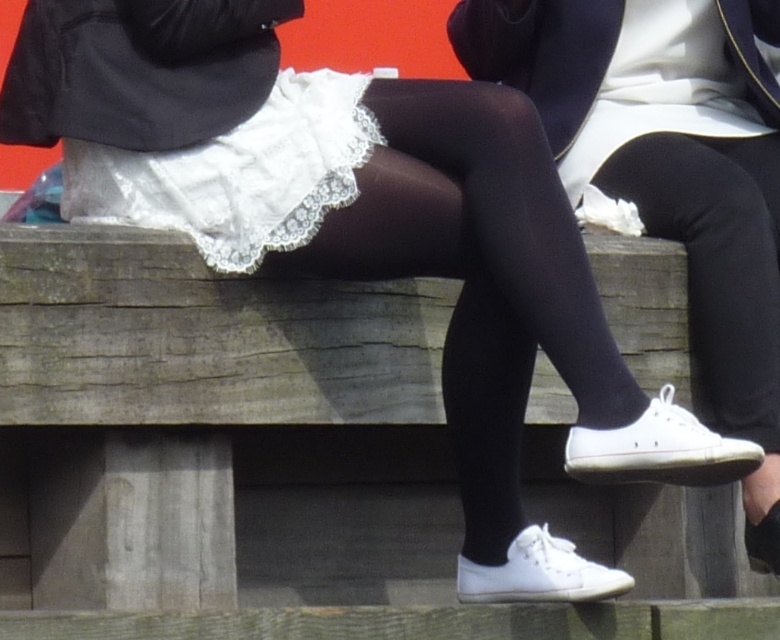
Question: Is white matte sneakers at lower center bigger than black tights at center?

Choices:
 (A) no
 (B) yes

Answer: (B)

Question: Based on their relative distances, which object is farther from the black matte leggings at right?

Choices:
 (A) white lace skirt at center
 (B) white matte sneakers at lower center

Answer: (A)

Question: Which is nearer to the white lace skirt at center?

Choices:
 (A) white matte sneakers at lower center
 (B) black matte leggings at right

Answer: (A)

Question: Does black tights at center appear on the right side of black matte leggings at right?

Choices:
 (A) yes
 (B) no

Answer: (B)

Question: Can you confirm if white lace skirt at center is smaller than black matte leggings at right?

Choices:
 (A) yes
 (B) no

Answer: (A)

Question: Which of the following is the closest to the observer?

Choices:
 (A) (746, 177)
 (B) (520, 225)
 (C) (263, 212)
 (D) (640, 64)

Answer: (B)